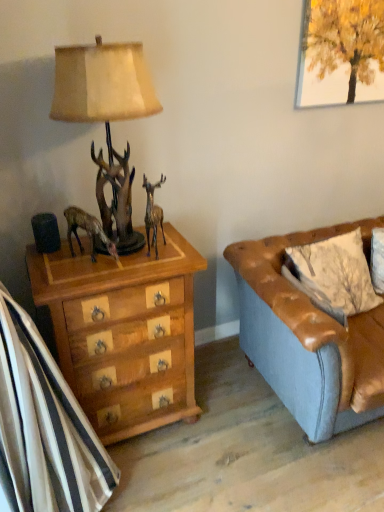
Question: Is metallic gold reindeer at center directly adjacent to wooden chest of drawers at left?

Choices:
 (A) yes
 (B) no

Answer: (B)

Question: From the image's perspective, would you say metallic gold reindeer at center is positioned over wooden chest of drawers at left?

Choices:
 (A) no
 (B) yes

Answer: (B)

Question: From a real-world perspective, is metallic gold reindeer at center positioned under wooden chest of drawers at left based on gravity?

Choices:
 (A) yes
 (B) no

Answer: (B)

Question: Is metallic gold reindeer at center further to the viewer compared to wooden chest of drawers at left?

Choices:
 (A) no
 (B) yes

Answer: (B)

Question: Is metallic gold reindeer at center not near wooden chest of drawers at left?

Choices:
 (A) yes
 (B) no

Answer: (B)

Question: Is metallic gold reindeer at center closer to the viewer compared to wooden chest of drawers at left?

Choices:
 (A) yes
 (B) no

Answer: (B)

Question: Is brown leather couch at right positioned before metallic gold reindeer at center?

Choices:
 (A) yes
 (B) no

Answer: (A)

Question: Considering the relative sizes of brown leather couch at right and metallic gold reindeer at center in the image provided, is brown leather couch at right taller than metallic gold reindeer at center?

Choices:
 (A) no
 (B) yes

Answer: (B)

Question: Is brown leather couch at right shorter than metallic gold reindeer at center?

Choices:
 (A) yes
 (B) no

Answer: (B)

Question: Is brown leather couch at right positioned behind metallic gold reindeer at center?

Choices:
 (A) yes
 (B) no

Answer: (B)

Question: Does brown leather couch at right have a smaller size compared to metallic gold reindeer at center?

Choices:
 (A) no
 (B) yes

Answer: (A)

Question: Considering the relative sizes of brown leather couch at right and metallic gold reindeer at center in the image provided, is brown leather couch at right thinner than metallic gold reindeer at center?

Choices:
 (A) no
 (B) yes

Answer: (A)

Question: Does wooden chest of drawers at left have a greater width compared to antique brown statue at left?

Choices:
 (A) no
 (B) yes

Answer: (B)